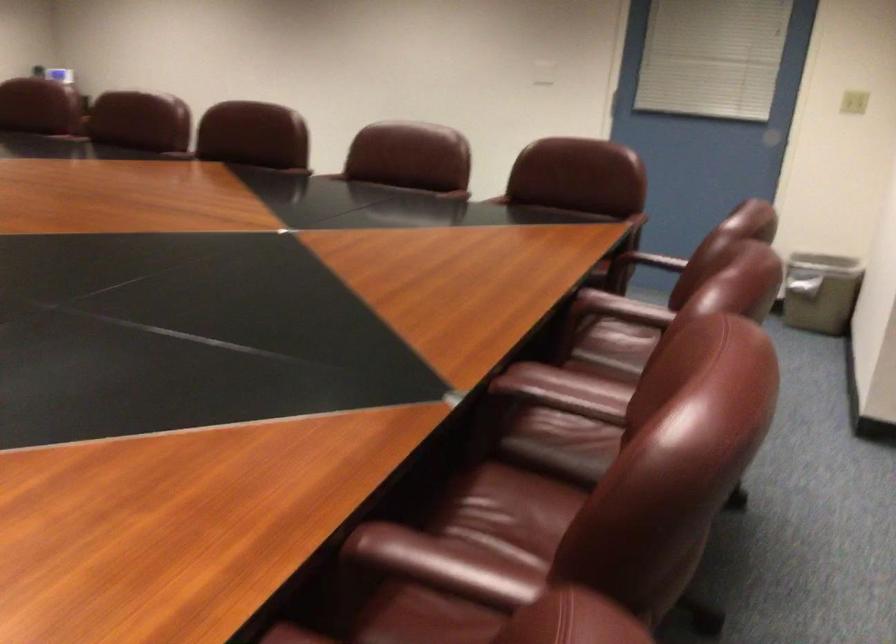
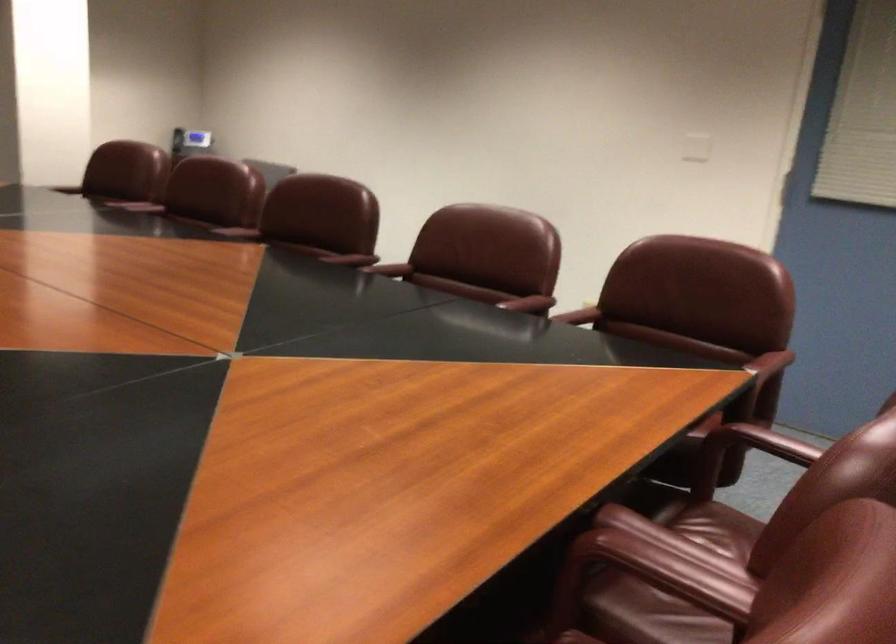
Locate, in the second image, the point that corresponds to point (458, 189) in the first image.

(529, 303)